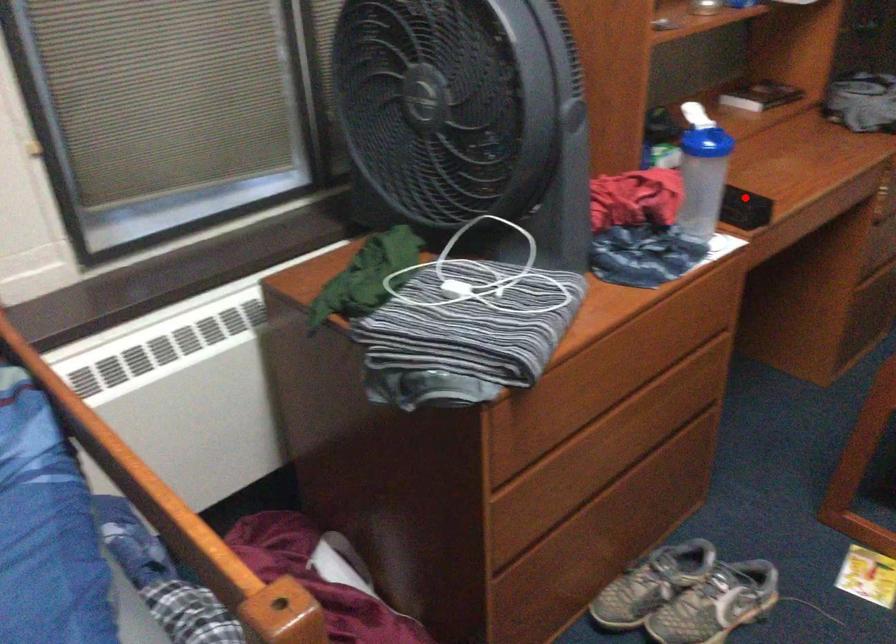
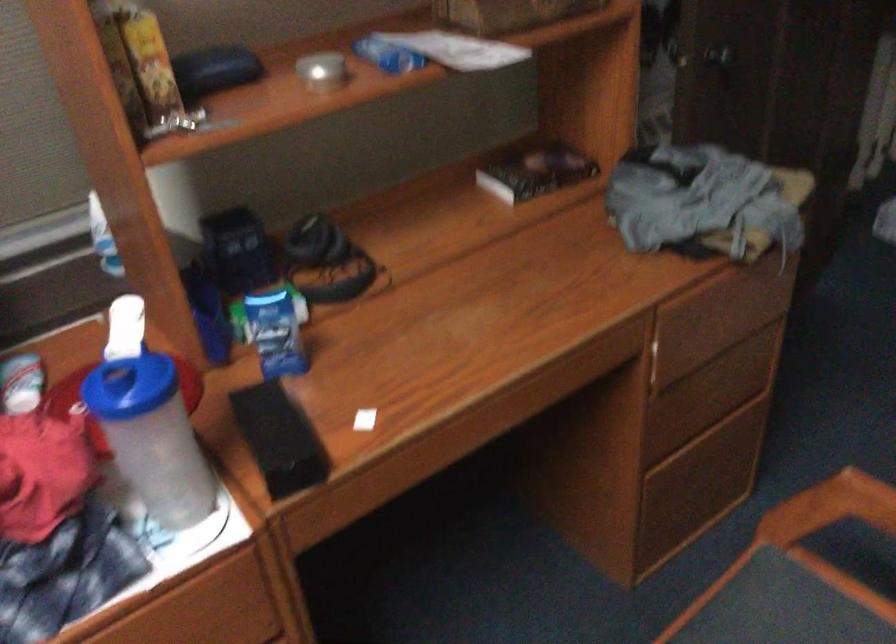
Locate, in the second image, the point that corresponds to the highlighted location in the first image.

(279, 438)